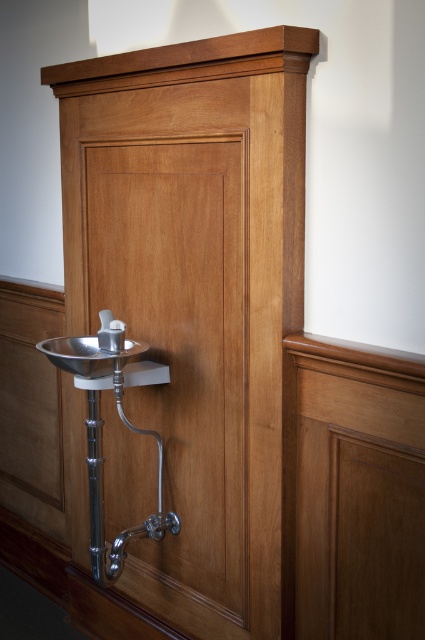
Is polished stainless steel sink at lower left wider than polished chrome faucet at center?

Yes, polished stainless steel sink at lower left is wider than polished chrome faucet at center.

Is polished stainless steel sink at lower left closer to camera compared to polished chrome faucet at center?

Yes, it is in front of polished chrome faucet at center.

This screenshot has height=640, width=425. What are the coordinates of `polished stainless steel sink at lower left` in the screenshot? It's located at (87, 355).